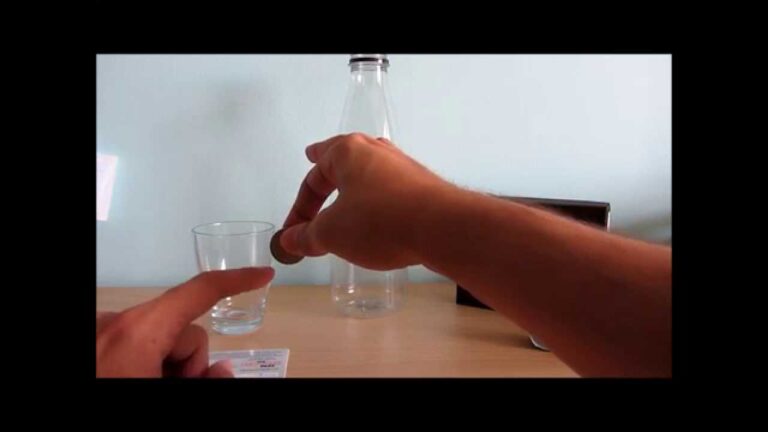
The image size is (768, 432). I want to click on shot glass, so click(x=227, y=253).